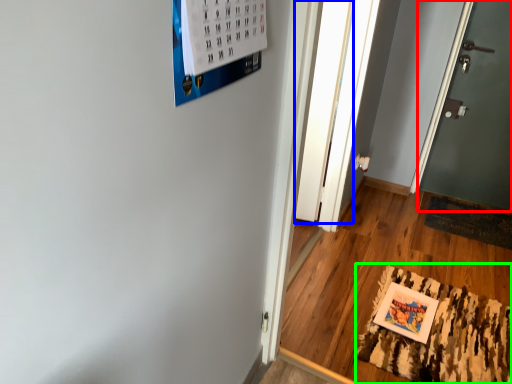
Question: Which object is the farthest from door (highlighted by a red box)? Choose among these: glass door (highlighted by a blue box) or mat (highlighted by a green box).

Choices:
 (A) glass door
 (B) mat

Answer: (B)